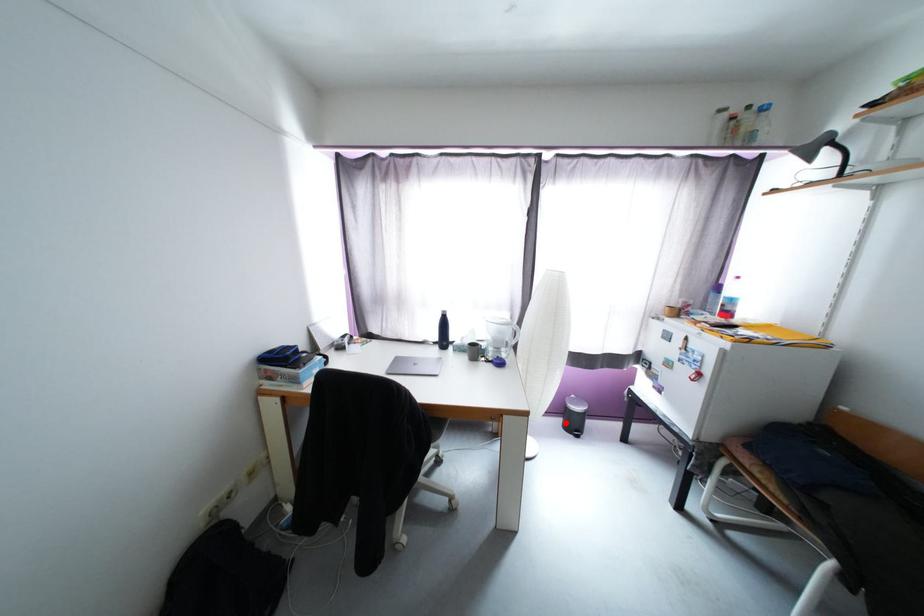
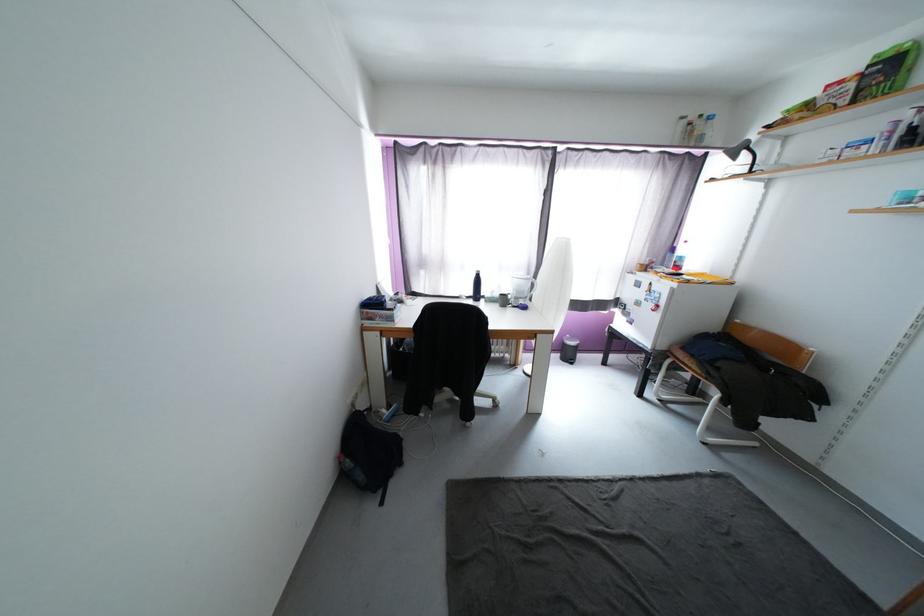
Find the pixel in the second image that matches the highlighted location in the first image.

(564, 357)